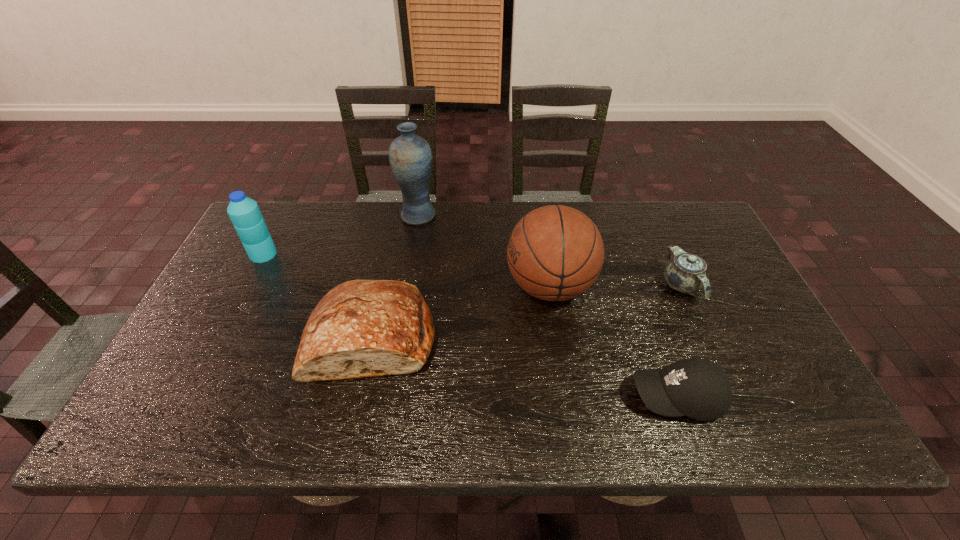
Find the location of a particular element. The width and height of the screenshot is (960, 540). vase is located at coordinates (410, 156).

Identify the location of the tallest object. This screenshot has width=960, height=540. (410, 156).

Image resolution: width=960 pixels, height=540 pixels. Identify the location of the fourth object from left to right. (555, 253).

At what (x,y) coordinates should I click in order to perform the action: click on the third tallest object. Please return your answer as a coordinate pair (x, y). Looking at the image, I should click on (244, 212).

Where is `the leftmost object`? The height and width of the screenshot is (540, 960). the leftmost object is located at coordinates (244, 212).

Identify the location of bread. (361, 328).

Image resolution: width=960 pixels, height=540 pixels. In order to click on chinaware in this screenshot , I will do `click(686, 273)`.

Find the location of a particular element. The height and width of the screenshot is (540, 960). baseball cap is located at coordinates (698, 388).

Where is `free region located 0.220m on the left of the farthest object`? The width and height of the screenshot is (960, 540). free region located 0.220m on the left of the farthest object is located at coordinates (332, 216).

Where is `vacant region located on the side with brand label of the fourth object from left to right`? Image resolution: width=960 pixels, height=540 pixels. vacant region located on the side with brand label of the fourth object from left to right is located at coordinates (466, 286).